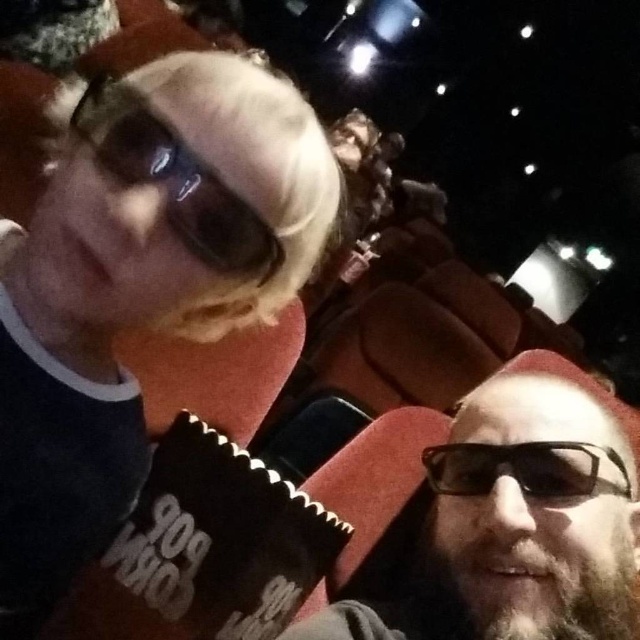
Who is positioned more to the left, matte black sunglasses at upper left or black plastic glasses at lower right?

matte black sunglasses at upper left

Is point (99, 435) positioned in front of point (445, 448)?

That is True.

This screenshot has width=640, height=640. I want to click on matte black sunglasses at upper left, so click(138, 285).

Locate an element on the screen. matte black sunglasses at upper left is located at coordinates (138, 285).

Who is lower down, matte black sunglasses at upper left or bearddark brown/thickfacial hair at right?

bearddark brown/thickfacial hair at right is lower down.

Is matte black sunglasses at upper left further to camera compared to bearddark brown/thickfacial hair at right?

No, it is in front of bearddark brown/thickfacial hair at right.

This screenshot has width=640, height=640. What do you see at coordinates (138, 285) in the screenshot? I see `matte black sunglasses at upper left` at bounding box center [138, 285].

Find the location of a particular element. matte black sunglasses at upper left is located at coordinates (138, 285).

How far apart are bearddark brown/thickfacial hair at right and black plastic glasses at lower right?

bearddark brown/thickfacial hair at right is 1.99 inches away from black plastic glasses at lower right.

Does bearddark brown/thickfacial hair at right come in front of black plastic glasses at lower right?

Yes, it is.

Who is more distant from viewer, (531, 544) or (516, 451)?

The point (516, 451) is more distant.

Where is `bearddark brown/thickfacial hair at right`? This screenshot has width=640, height=640. bearddark brown/thickfacial hair at right is located at coordinates (529, 572).